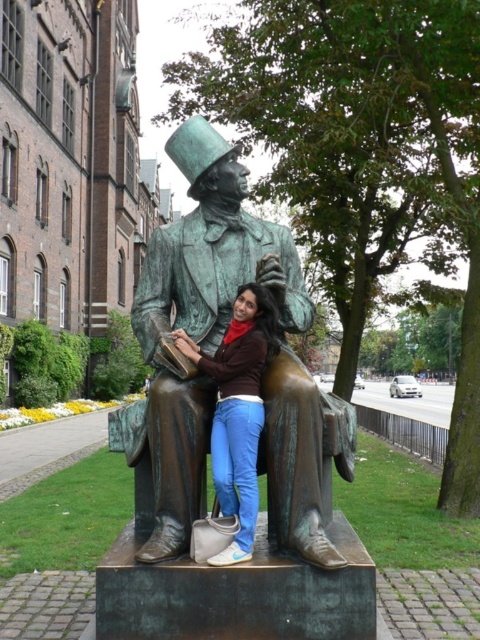
You are a photographer trying to capture a clear image of both the green patina bronze statue at center and the matte bronze statue at center. Since you want to ensure both are in focus, which statue should you focus on first to maximize clarity?

You should focus on the green patina bronze statue at center first because it is closer to the viewer than the matte bronze statue at center, so adjusting focus from near to far will help ensure both are sharp.

You are a photographer standing at the point marked as point (196,324). You want to take a photo of the green patina bronze statue at center. Where should you position yourself to capture the statue in the frame?

You should position yourself at point (196,324) to capture the green patina bronze statue at center in the frame since that is the location of the statue.